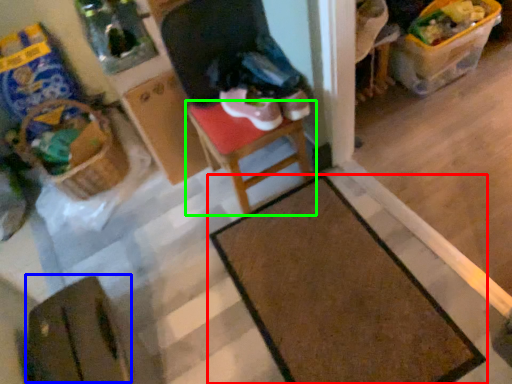
Question: Estimate the real-world distances between objects in this image. Which object is closer to table (highlighted by a red box), wide (highlighted by a blue box) or furniture (highlighted by a green box)?

Choices:
 (A) wide
 (B) furniture

Answer: (B)